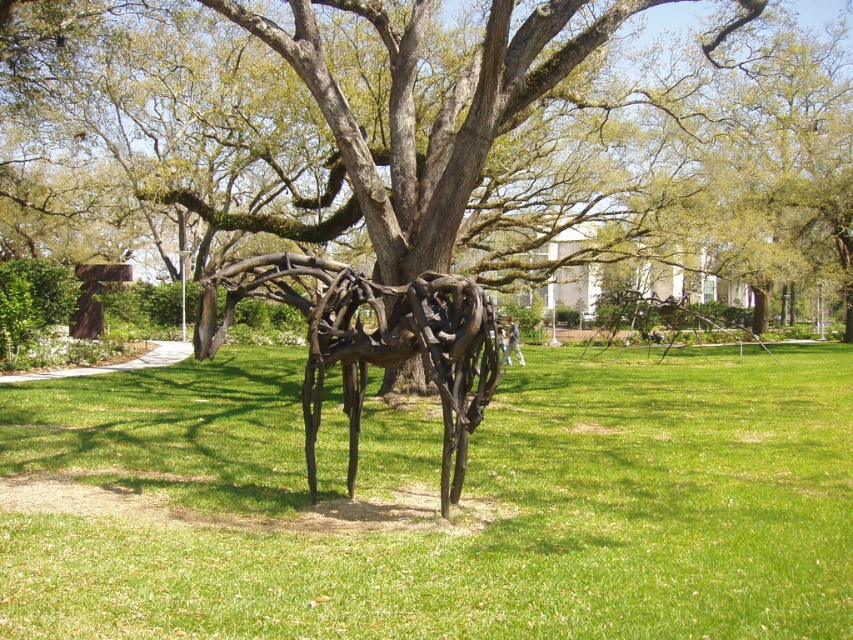
Question: Does green grass at center have a greater width compared to rustic metal spider at center?

Choices:
 (A) yes
 (B) no

Answer: (A)

Question: From the image, what is the correct spatial relationship of green grass at center in relation to rustic metal spider at center?

Choices:
 (A) below
 (B) above

Answer: (A)

Question: Which of the following is the closest to the observer?

Choices:
 (A) (473, 552)
 (B) (312, 316)

Answer: (A)

Question: Where is green grass at center located in relation to rustic metal spider at center in the image?

Choices:
 (A) below
 (B) above

Answer: (A)

Question: Which point is farther to the camera?

Choices:
 (A) green grass at center
 (B) rustic metal spider at center

Answer: (B)